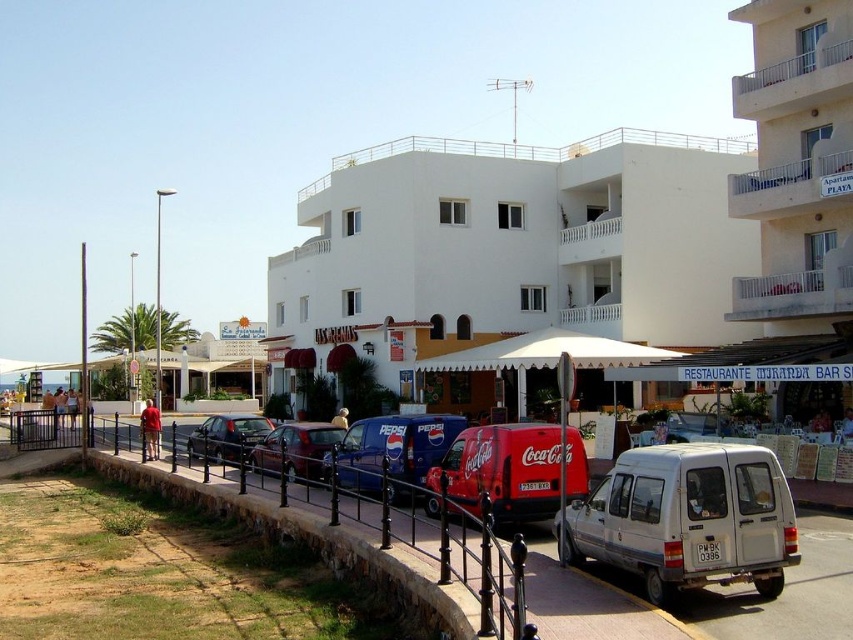
You are a delivery person who needs to park your truck next to the silver metallic van at center. However, there is a black metal fence at lower center in the way. Can your truck pass under the fence without hitting it?

The silver metallic van at center is not as tall as the black metal fence at lower center, so the truck can pass under the fence without hitting it since the fence is taller than the van.

You are a tour guide leading a group to a nearby beach. Your silver metallic van at center is parked near the black metal fence at lower center. The beach is located 5 meters away from the fence. Can you drive your van directly to the beach without moving the van from its current position?

The silver metallic van at center is 4.62 meters away from the black metal fence at lower center. Since the beach is 5 meters away from the fence, the van is within the required distance. Therefore, you can drive the silver metallic van at center directly to the beach without moving it from its current position.

You are a tourist driving a car and want to park your vehicle between the blue metallic van at center and the shiny black sedan at center. Is there enough space for your car, which is 4 meters long?

The blue metallic van at center is positioned on the right side of the shiny black sedan at center. However, the exact distance between them is not provided, so it is impossible to determine if there is enough space for a 4 meter car.